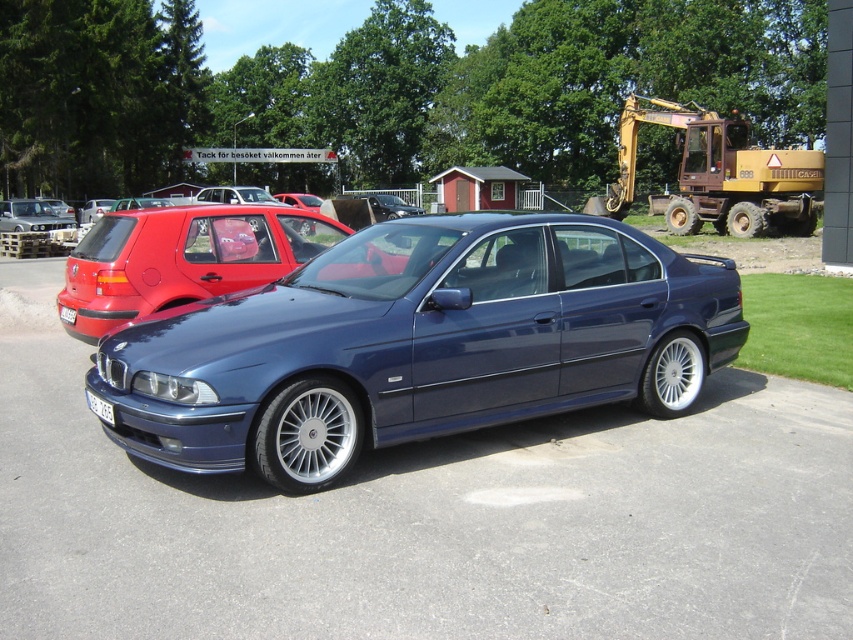
Question: Can you confirm if matte black car at center is positioned below white plastic license plate at lower center?

Choices:
 (A) no
 (B) yes

Answer: (A)

Question: Is metallic blue sedan at center closer to the viewer compared to white plastic license plate at lower center?

Choices:
 (A) yes
 (B) no

Answer: (A)

Question: Which point appears farthest from the camera in this image?

Choices:
 (A) (64, 305)
 (B) (521, 410)
 (C) (292, 230)
 (D) (44, 214)

Answer: (D)

Question: Can you confirm if white plastic license plate at lower center is smaller than white plastic license plate at center?

Choices:
 (A) no
 (B) yes

Answer: (B)

Question: Which of the following is the farthest from the observer?

Choices:
 (A) (x=15, y=204)
 (B) (x=105, y=413)

Answer: (A)

Question: Which of the following is the closest to the observer?

Choices:
 (A) (316, 305)
 (B) (657, 113)

Answer: (A)